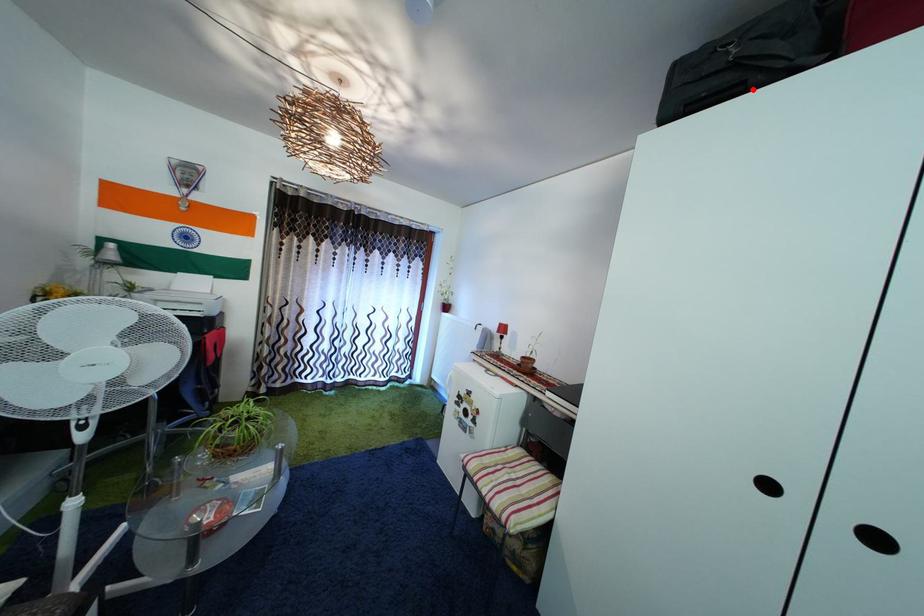
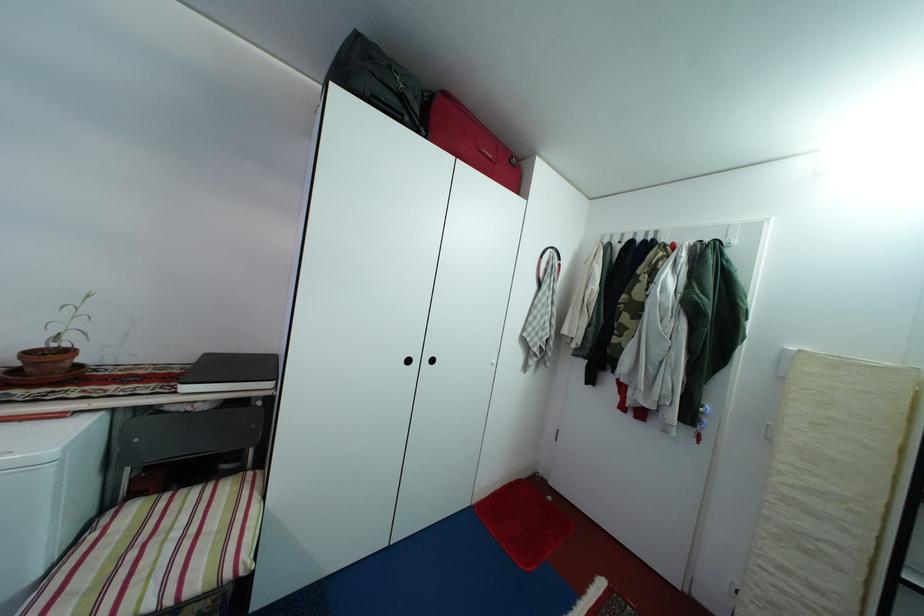
Question: I am providing you with two images of the same scene from different viewpoints. A red point is marked on the first image. At the location where the point appears in image 1, is it still visible in image 2?

Choices:
 (A) Yes
 (B) No

Answer: (A)